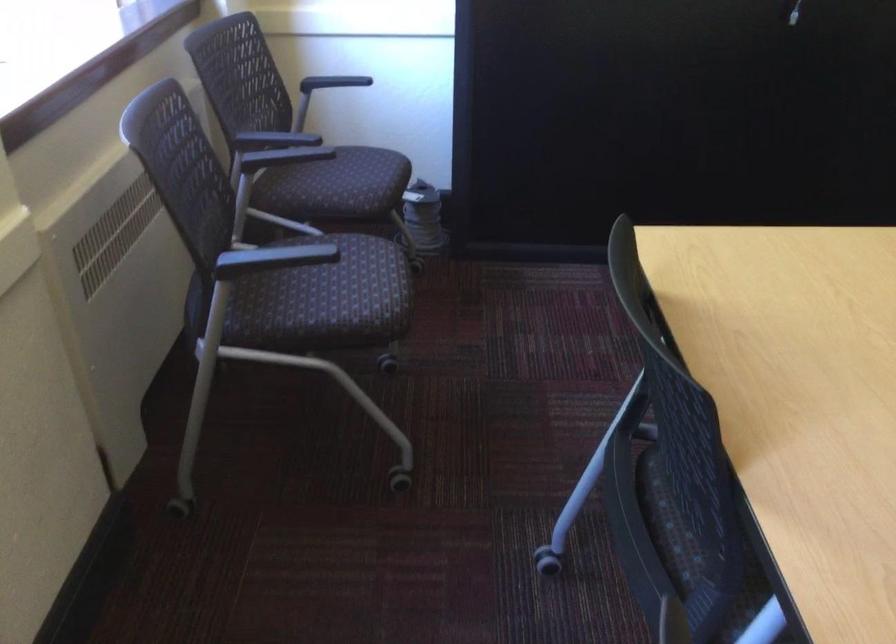
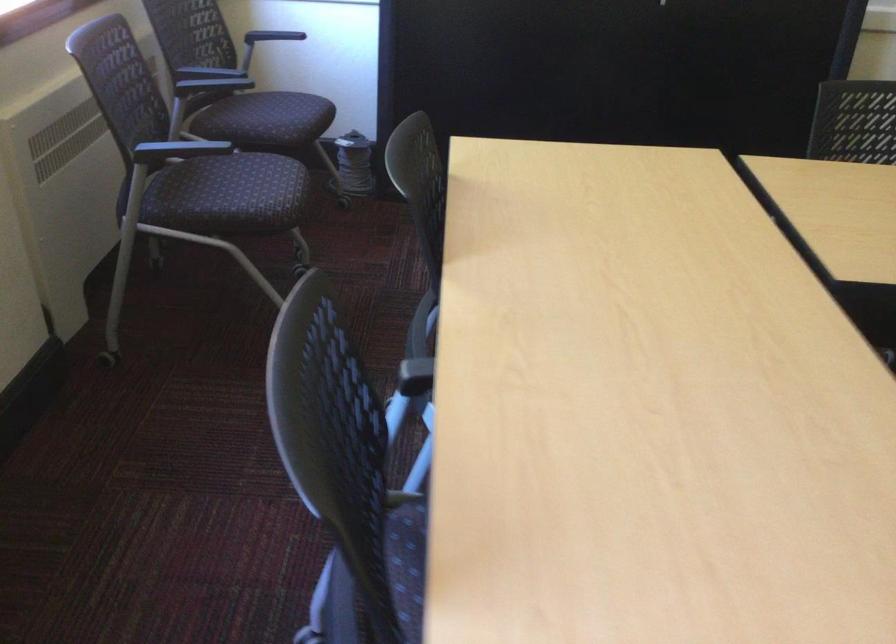
In the second image, find the point that corresponds to the point at 265,263 in the first image.

(176, 149)